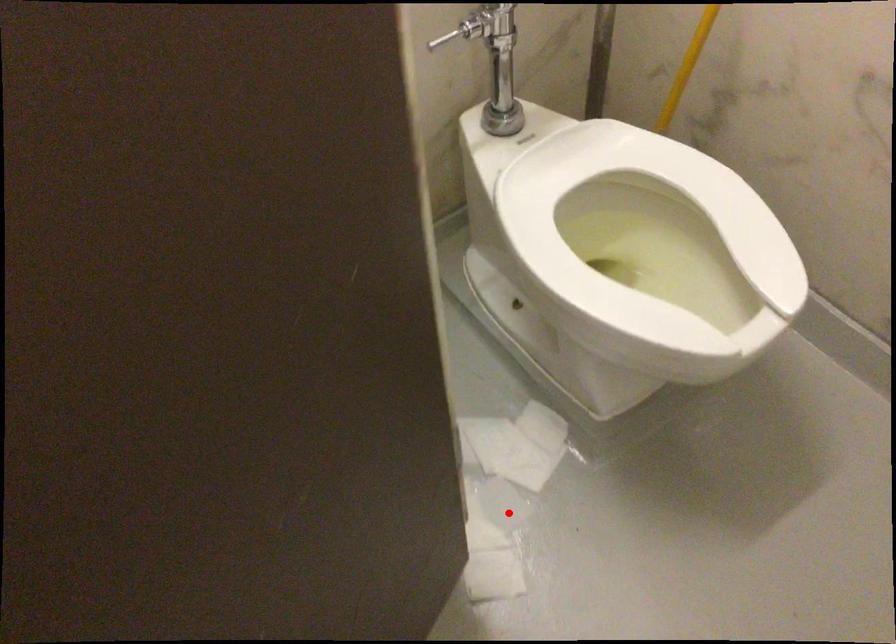
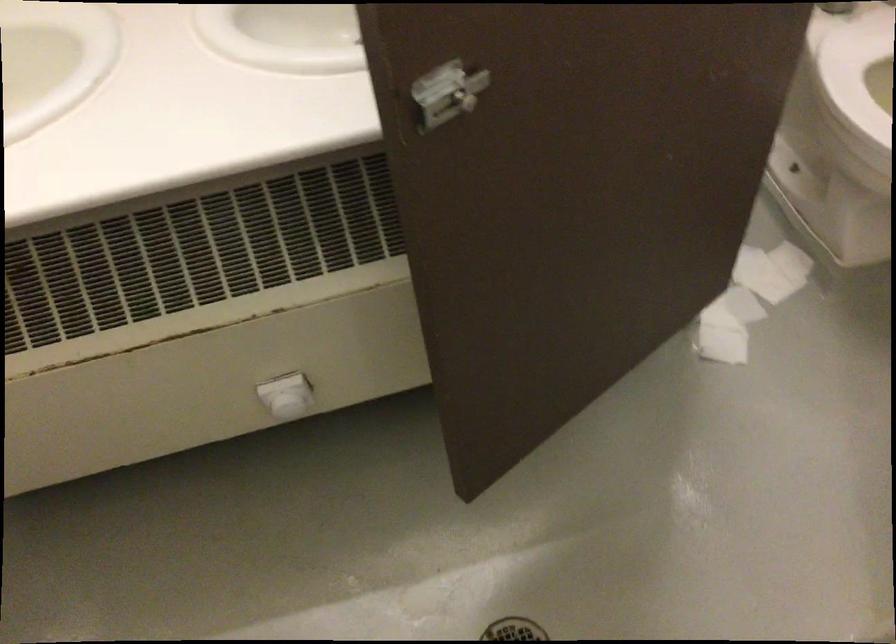
Question: I am providing you with two images of the same scene from different viewpoints. Given a red point in image1, look at the same physical point in image2. Is it:

Choices:
 (A) Closer to the viewpoint
 (B) Farther from the viewpoint

Answer: (B)